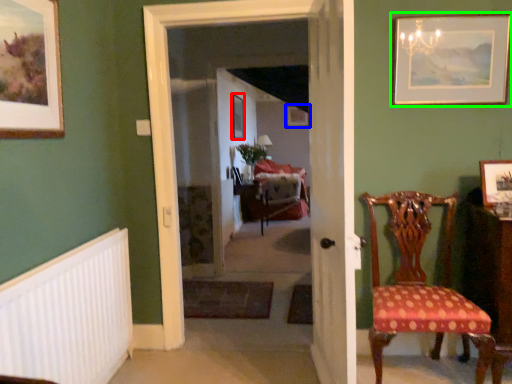
Question: Which is farther away from picture frame (highlighted by a red box)? picture frame (highlighted by a blue box) or picture frame (highlighted by a green box)?

Choices:
 (A) picture frame
 (B) picture frame

Answer: (B)